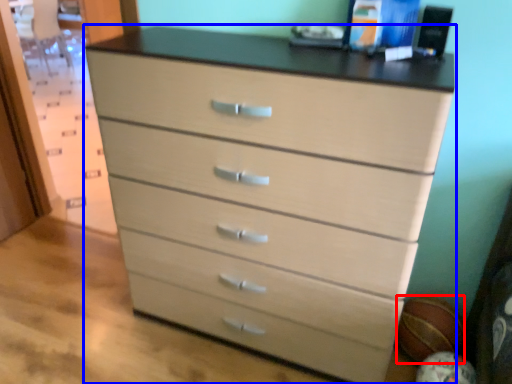
Question: Which object is further to the camera taking this photo, basketball (highlighted by a red box) or chest of drawers (highlighted by a blue box)?

Choices:
 (A) basketball
 (B) chest of drawers

Answer: (A)